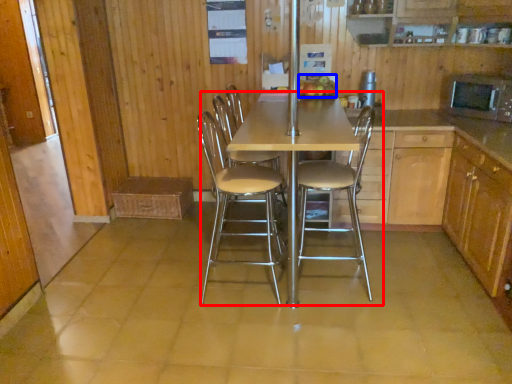
Question: Which object is closer to the camera taking this photo, kitchen & dining room table (highlighted by a red box) or fruit (highlighted by a blue box)?

Choices:
 (A) kitchen & dining room table
 (B) fruit

Answer: (A)